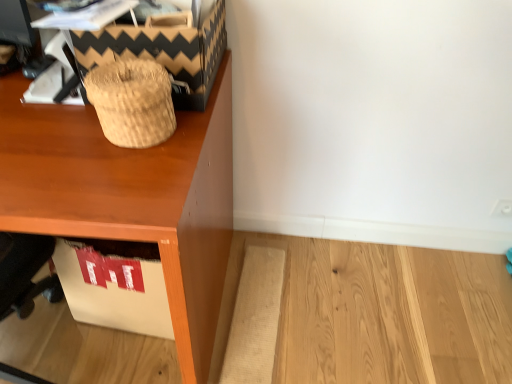
The width and height of the screenshot is (512, 384). Find the location of `free space in front of brown woven basket at upper left`. free space in front of brown woven basket at upper left is located at coordinates (94, 158).